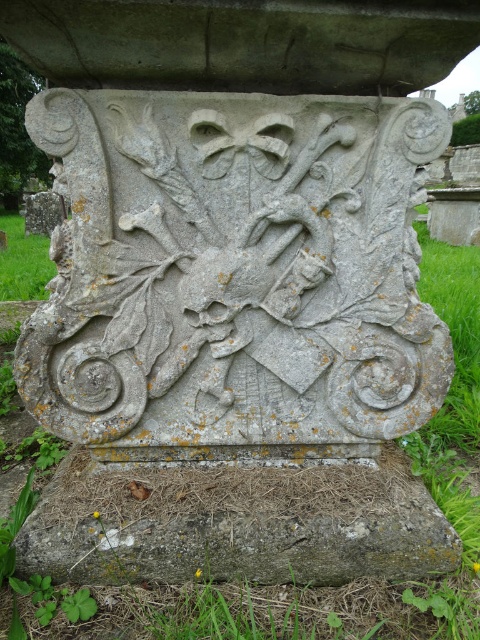
Between gray stone shield at center and green grass at lower left, which one appears on the left side from the viewer's perspective?

Positioned to the left is green grass at lower left.

Can you confirm if gray stone shield at center is bigger than green grass at lower left?

No, gray stone shield at center is not bigger than green grass at lower left.

You are a GUI agent. You are given a task and a screenshot of the screen. Output one action in this format:
    pyautogui.click(x=<x>, y=<y>)
    Task: Click on the gray stone shield at center
    
    Given the screenshot: What is the action you would take?
    pyautogui.click(x=233, y=275)

Does green grass at center have a greater height compared to green grass at lower left?

Correct, green grass at center is much taller as green grass at lower left.

Can you confirm if green grass at center is positioned to the right of green grass at lower left?

Correct, you'll find green grass at center to the right of green grass at lower left.

Where is `green grass at center`? The height and width of the screenshot is (640, 480). green grass at center is located at coordinates (412, 470).

Describe the element at coordinates (237, 524) in the screenshot. I see `gray stone base at center` at that location.

Which is behind, point (73, 545) or point (24, 250)?

Positioned behind is point (24, 250).

Where is `gray stone base at center`? gray stone base at center is located at coordinates (237, 524).

I want to click on gray stone base at center, so click(237, 524).